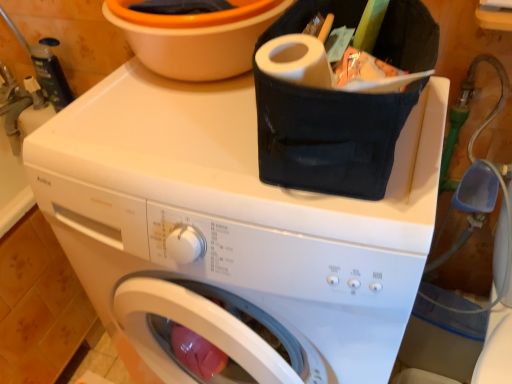
At what (x,y) coordinates should I click in order to perform the action: click on orange plastic basin at upper center. Please return your answer as a coordinate pair (x, y). Looking at the image, I should click on (196, 38).

What do you see at coordinates (196, 38) in the screenshot? The width and height of the screenshot is (512, 384). I see `orange plastic basin at upper center` at bounding box center [196, 38].

What is the approximate height of orange plastic basin at upper center?

orange plastic basin at upper center is 5.91 inches in height.

Describe the element at coordinates (231, 231) in the screenshot. The height and width of the screenshot is (384, 512). I see `white matte washing machine at upper center` at that location.

Where is `white matte washing machine at upper center`? Image resolution: width=512 pixels, height=384 pixels. white matte washing machine at upper center is located at coordinates (231, 231).

I want to click on orange plastic basin at upper center, so click(x=196, y=38).

Considering the relative positions of orange plastic basin at upper center and white matte washing machine at upper center in the image provided, is orange plastic basin at upper center to the left of white matte washing machine at upper center from the viewer's perspective?

Yes, orange plastic basin at upper center is to the left of white matte washing machine at upper center.

Looking at this image, considering the positions of objects orange plastic basin at upper center and white matte washing machine at upper center in the image provided, who is in front, orange plastic basin at upper center or white matte washing machine at upper center?

white matte washing machine at upper center is closer to the camera.

Which is in front, point (157, 31) or point (394, 242)?

Point (394, 242)

From the image's perspective, which one is positioned lower, orange plastic basin at upper center or white matte washing machine at upper center?

From the image's view, white matte washing machine at upper center is below.

From a real-world perspective, is orange plastic basin at upper center physically above white matte washing machine at upper center?

Correct, in the physical world, orange plastic basin at upper center is higher than white matte washing machine at upper center.

Does orange plastic basin at upper center have a greater width compared to white matte washing machine at upper center?

No.

Is orange plastic basin at upper center taller than white matte washing machine at upper center?

In fact, orange plastic basin at upper center may be shorter than white matte washing machine at upper center.

Consider the image. Considering the sizes of objects orange plastic basin at upper center and white matte washing machine at upper center in the image provided, who is smaller, orange plastic basin at upper center or white matte washing machine at upper center?

orange plastic basin at upper center.

Can we say orange plastic basin at upper center lies outside white matte washing machine at upper center?

That's correct, orange plastic basin at upper center is outside of white matte washing machine at upper center.

In the scene shown: Is orange plastic basin at upper center not near white matte washing machine at upper center?

That's not correct — orange plastic basin at upper center is a little close to white matte washing machine at upper center.

Could you tell me if orange plastic basin at upper center is turned towards white matte washing machine at upper center?

No, orange plastic basin at upper center is not aimed at white matte washing machine at upper center.

Can you tell me how much orange plastic basin at upper center and white matte washing machine at upper center differ in facing direction?

The angle between the facing direction of orange plastic basin at upper center and the facing direction of white matte washing machine at upper center is 0.000186 degrees.

Identify the location of washing machine below the orange plastic basin at upper center (from the image's perspective). The height and width of the screenshot is (384, 512). (231, 231).

Is white matte washing machine at upper center to the left or to the right of orange plastic basin at upper center in the image?

In the image, white matte washing machine at upper center appears on the right side of orange plastic basin at upper center.

Who is more distant, white matte washing machine at upper center or orange plastic basin at upper center?

orange plastic basin at upper center is further away from the camera.

Is point (193, 188) positioned in front of point (168, 20)?

Yes.

From the image's perspective, which one is positioned lower, white matte washing machine at upper center or orange plastic basin at upper center?

white matte washing machine at upper center appears lower in the image.

From a real-world perspective, who is located lower, white matte washing machine at upper center or orange plastic basin at upper center?

In real-world perspective, white matte washing machine at upper center is lower.

Looking at their sizes, would you say white matte washing machine at upper center is wider or thinner than orange plastic basin at upper center?

Considering their sizes, white matte washing machine at upper center looks broader than orange plastic basin at upper center.

Between white matte washing machine at upper center and orange plastic basin at upper center, which one has less height?

orange plastic basin at upper center.

Which of these two, white matte washing machine at upper center or orange plastic basin at upper center, is bigger?

white matte washing machine at upper center.

Which is correct: white matte washing machine at upper center is inside orange plastic basin at upper center, or outside of it?

white matte washing machine at upper center exists outside the volume of orange plastic basin at upper center.

Is white matte washing machine at upper center with orange plastic basin at upper center?

white matte washing machine at upper center is not next to orange plastic basin at upper center, and they're not touching.

Is white matte washing machine at upper center looking in the opposite direction of orange plastic basin at upper center?

No, white matte washing machine at upper center's orientation is not away from orange plastic basin at upper center.

How many degrees apart are the facing directions of white matte washing machine at upper center and orange plastic basin at upper center?

They differ by 0.000186 degrees in their facing directions.

Looking at this image, could you measure the distance between white matte washing machine at upper center and orange plastic basin at upper center?

white matte washing machine at upper center and orange plastic basin at upper center are 26.77 centimeters apart.

You are a GUI agent. You are given a task and a screenshot of the screen. Output one action in this format:
    pyautogui.click(x=<x>, y=<y>)
    Task: Click on the washing machine located on the right of orange plastic basin at upper center
    
    Given the screenshot: What is the action you would take?
    pyautogui.click(x=231, y=231)

Identify the location of washing machine below the orange plastic basin at upper center (from the image's perspective). The image size is (512, 384). pyautogui.click(x=231, y=231).

Locate an element on the screen. basin above the white matte washing machine at upper center (from a real-world perspective) is located at coordinates (196, 38).